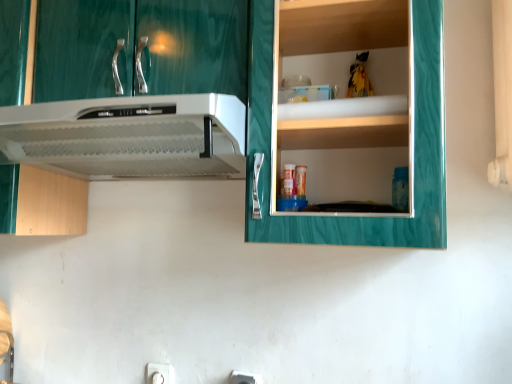
Question: Can you confirm if white plastic electric outlet at lower center, marked as the first electric outlet in a front-to-back arrangement, is thinner than white plastic electric outlet at lower center, placed as the 2th electric outlet when sorted from front to back?

Choices:
 (A) no
 (B) yes

Answer: (A)

Question: Is white plastic electric outlet at lower center, the 1th electric outlet from the right, shorter than white plastic electric outlet at lower center, placed as the 2th electric outlet when sorted from front to back?

Choices:
 (A) no
 (B) yes

Answer: (A)

Question: Can you confirm if white plastic electric outlet at lower center, marked as the first electric outlet in a front-to-back arrangement, is smaller than white plastic electric outlet at lower center, placed as the 2th electric outlet when sorted from front to back?

Choices:
 (A) yes
 (B) no

Answer: (B)

Question: From a real-world perspective, is white plastic electric outlet at lower center, the 1th electric outlet from the right, physically below white plastic electric outlet at lower center, the first electric outlet in the back-to-front sequence?

Choices:
 (A) yes
 (B) no

Answer: (B)

Question: Is white plastic electric outlet at lower center, the second electric outlet in the left-to-right sequence, at the left side of white plastic electric outlet at lower center, the 1th electric outlet viewed from the left?

Choices:
 (A) yes
 (B) no

Answer: (B)

Question: Is white plastic electric outlet at lower center, the 1th electric outlet from the right, wider or thinner than green marble cabinet at upper right?

Choices:
 (A) thin
 (B) wide

Answer: (A)

Question: From the image's perspective, is white plastic electric outlet at lower center, arranged as the 2th electric outlet when viewed from the back, located above or below green marble cabinet at upper right?

Choices:
 (A) above
 (B) below

Answer: (B)

Question: Relative to green marble cabinet at upper right, is white plastic electric outlet at lower center, the second electric outlet in the left-to-right sequence, in front or behind?

Choices:
 (A) behind
 (B) front

Answer: (A)

Question: In terms of size, does white plastic electric outlet at lower center, marked as the first electric outlet in a front-to-back arrangement, appear bigger or smaller than green marble cabinet at upper right?

Choices:
 (A) big
 (B) small

Answer: (B)

Question: Do you think green marble cabinet at upper right is within white plastic electric outlet at lower center, the second electric outlet in the left-to-right sequence, or outside of it?

Choices:
 (A) inside
 (B) outside

Answer: (B)

Question: Based on their sizes in the image, would you say green marble cabinet at upper right is bigger or smaller than white plastic electric outlet at lower center, arranged as the 2th electric outlet when viewed from the back?

Choices:
 (A) small
 (B) big

Answer: (B)

Question: Is point (x=1, y=198) closer or farther from the camera than point (x=242, y=372)?

Choices:
 (A) farther
 (B) closer

Answer: (B)

Question: Considering the relative positions of green marble cabinet at upper right and white plastic electric outlet at lower center, marked as the first electric outlet in a front-to-back arrangement, in the image provided, is green marble cabinet at upper right to the left or to the right of white plastic electric outlet at lower center, marked as the first electric outlet in a front-to-back arrangement,?

Choices:
 (A) right
 (B) left

Answer: (B)

Question: Considering the positions of white plastic electric outlet at lower center, the first electric outlet in the back-to-front sequence, and white plastic electric outlet at lower center, the 1th electric outlet from the right, in the image, is white plastic electric outlet at lower center, the first electric outlet in the back-to-front sequence, bigger or smaller than white plastic electric outlet at lower center, the 1th electric outlet from the right,?

Choices:
 (A) big
 (B) small

Answer: (B)

Question: From a real-world perspective, is white plastic electric outlet at lower center, the first electric outlet in the back-to-front sequence, physically located above or below white plastic electric outlet at lower center, the 1th electric outlet from the right?

Choices:
 (A) below
 (B) above

Answer: (A)